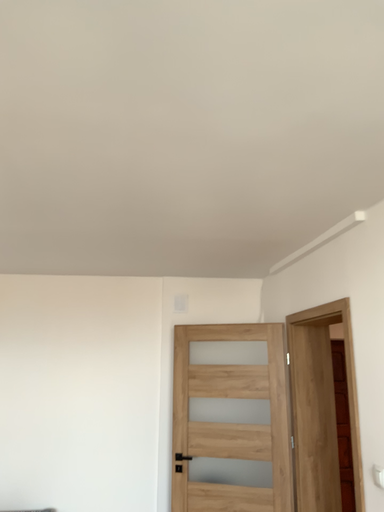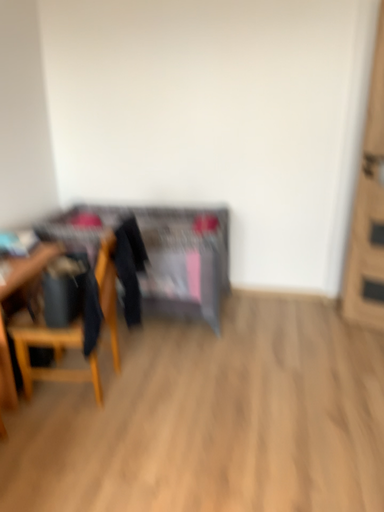
Question: Which way did the camera rotate in the video?

Choices:
 (A) rotated downward
 (B) rotated upward

Answer: (A)